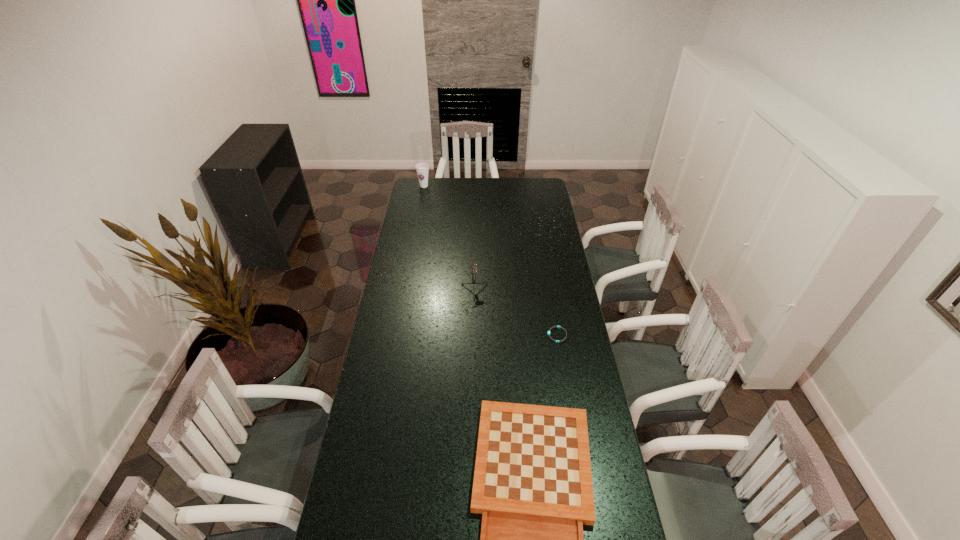
This screenshot has width=960, height=540. I want to click on the leftmost object, so click(x=422, y=169).

You are a GUI agent. You are given a task and a screenshot of the screen. Output one action in this format:
    pyautogui.click(x=<x>, y=<y>)
    Task: Click on the cup
    Image resolution: width=960 pixels, height=540 pixels.
    Given the screenshot: What is the action you would take?
    pyautogui.click(x=422, y=169)

Find the location of `microphone`. microphone is located at coordinates (474, 271).

The width and height of the screenshot is (960, 540). In order to click on the third farthest object in this screenshot , I will do `click(557, 341)`.

Identify the location of wristband. (557, 341).

You are a GUI agent. You are given a task and a screenshot of the screen. Output one action in this format:
    pyautogui.click(x=<x>, y=<y>)
    Task: Click on the vacant space situated 0.160m on the front of the leftmost object
    This screenshot has width=960, height=540.
    Given the screenshot: What is the action you would take?
    pyautogui.click(x=420, y=204)

At what (x,y) coordinates should I click in order to perform the action: click on free space located on the stand of the microphone. Please return your answer as a coordinate pair (x, y). Looking at the image, I should click on (472, 347).

Where is `vacant space located 0.190m on the buckle of the second nearest object`? Image resolution: width=960 pixels, height=540 pixels. vacant space located 0.190m on the buckle of the second nearest object is located at coordinates (502, 335).

Locate an element on the screen. The height and width of the screenshot is (540, 960). vacant space located 0.150m on the buckle of the second nearest object is located at coordinates (512, 335).

In order to click on free location located 0.220m on the buckle of the second nearest object in this screenshot , I will do `click(494, 335)`.